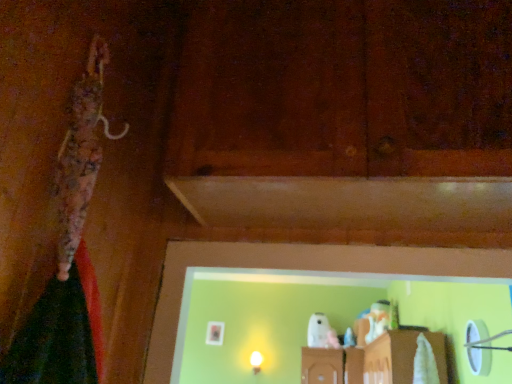
Question: Is point 257,354 positioned closer to the camera than point 340,150?

Choices:
 (A) closer
 (B) farther

Answer: (B)

Question: Is matte white bulb at center to the left or to the right of brown matte wood at center in the image?

Choices:
 (A) left
 (B) right

Answer: (A)

Question: From the image's perspective, relative to brown matte wood at center, is matte white bulb at center above or below?

Choices:
 (A) above
 (B) below

Answer: (B)

Question: From the image's perspective, relative to matte white bulb at center, is brown matte wood at center above or below?

Choices:
 (A) below
 (B) above

Answer: (B)

Question: Considering their positions, is brown matte wood at center located in front of or behind matte white bulb at center?

Choices:
 (A) behind
 (B) front

Answer: (B)

Question: In terms of width, does brown matte wood at center look wider or thinner when compared to matte white bulb at center?

Choices:
 (A) wide
 (B) thin

Answer: (A)

Question: Would you say brown matte wood at center is inside or outside matte white bulb at center?

Choices:
 (A) outside
 (B) inside

Answer: (A)